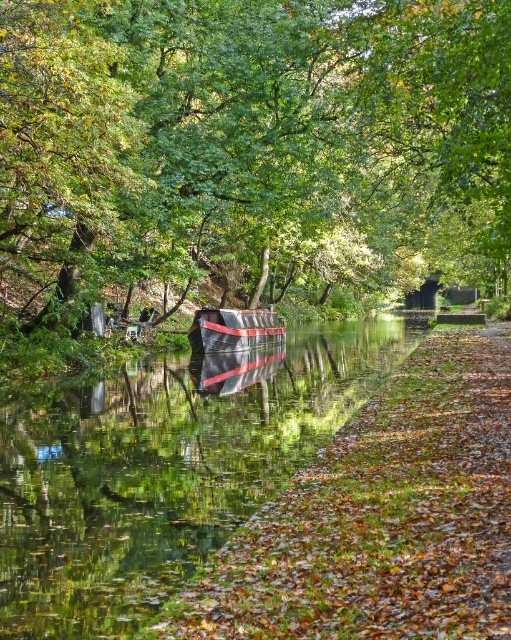
Question: Is green glossy water at center to the right of metallic silver boat at center from the viewer's perspective?

Choices:
 (A) yes
 (B) no

Answer: (B)

Question: Which object appears farthest from the camera in this image?

Choices:
 (A) green leafy tree at center
 (B) metallic silver boat at center
 (C) green glossy water at center

Answer: (B)

Question: Can you confirm if green leafy tree at center is positioned to the left of green glossy water at center?

Choices:
 (A) yes
 (B) no

Answer: (B)

Question: Estimate the real-world distances between objects in this image. Which object is closer to the green glossy water at center?

Choices:
 (A) green leafy tree at center
 (B) metallic silver boat at center

Answer: (B)

Question: Does green glossy water at center have a lesser width compared to metallic silver boat at center?

Choices:
 (A) yes
 (B) no

Answer: (B)

Question: Which of the following is the closest to the observer?

Choices:
 (A) green glossy water at center
 (B) green leafy tree at center
 (C) metallic silver boat at center

Answer: (A)